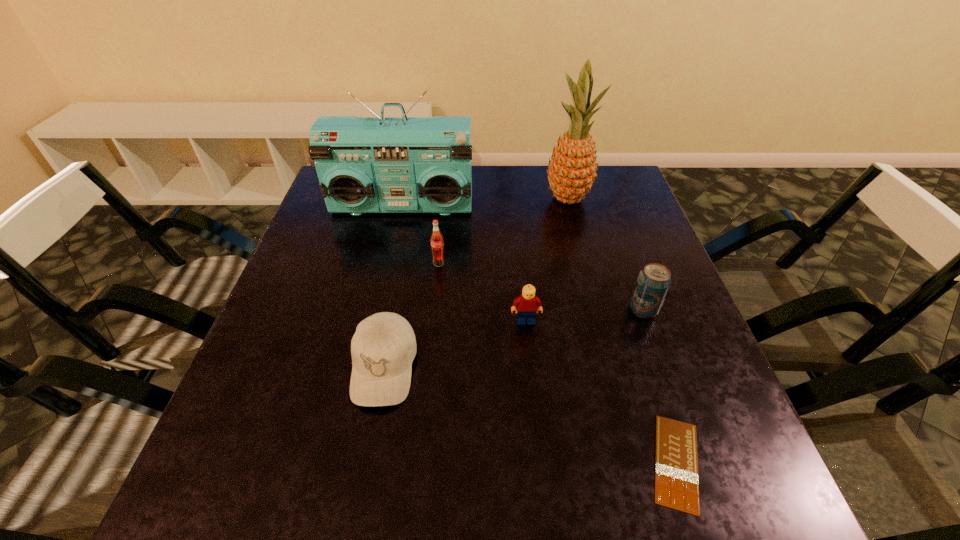
At what (x,y) coordinates should I click in order to perform the action: click on free point located on the front-facing side of the radio receiver. Please return your answer as a coordinate pair (x, y). Looking at the image, I should click on [x=391, y=264].

The image size is (960, 540). I want to click on free space located on the label of the fifth nearest object, so click(x=435, y=301).

Identify the location of free space located 0.120m on the front of the right pop soda. (664, 368).

At what (x,y) coordinates should I click in order to perform the action: click on vacant area situated on the front-facing side of the Lego. Please return your answer as a coordinate pair (x, y). Image resolution: width=960 pixels, height=540 pixels. Looking at the image, I should click on (540, 464).

Locate an element on the screen. The image size is (960, 540). vacant point located 0.110m on the front-facing side of the second nearest object is located at coordinates (364, 474).

Identify the location of free region located 0.290m on the left of the chocolate bar. (466, 462).

You are a GUI agent. You are given a task and a screenshot of the screen. Output one action in this format:
    pyautogui.click(x=<x>, y=<y>)
    Task: Click on the pineapple at the far edge
    This screenshot has height=540, width=960.
    Given the screenshot: What is the action you would take?
    pyautogui.click(x=572, y=169)

At what (x,y) coordinates should I click in order to perform the action: click on radio receiver located in the far edge section of the desktop. Please return your answer as a coordinate pair (x, y). Looking at the image, I should click on (404, 164).

Find the location of `object present at the near edge`. object present at the near edge is located at coordinates (676, 460).

This screenshot has height=540, width=960. I want to click on object present at the left edge, so 404,164.